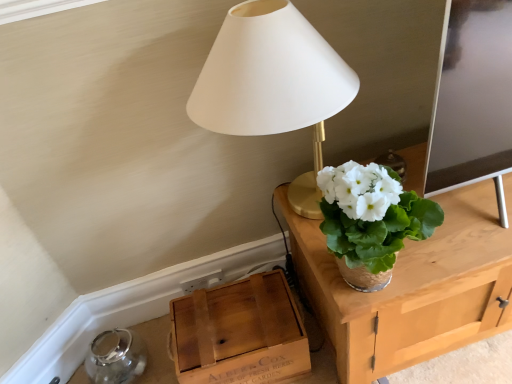
Question: Considering the relative sizes of wooden crate at lower left and white matte lampshade at upper center in the image provided, is wooden crate at lower left smaller than white matte lampshade at upper center?

Choices:
 (A) no
 (B) yes

Answer: (B)

Question: Does wooden crate at lower left have a greater height compared to white matte lampshade at upper center?

Choices:
 (A) no
 (B) yes

Answer: (A)

Question: Is wooden crate at lower left behind white matte lampshade at upper center?

Choices:
 (A) no
 (B) yes

Answer: (B)

Question: From a real-world perspective, does wooden crate at lower left sit lower than white matte lampshade at upper center?

Choices:
 (A) no
 (B) yes

Answer: (B)

Question: Is wooden crate at lower left to the right of white matte lampshade at upper center from the viewer's perspective?

Choices:
 (A) yes
 (B) no

Answer: (B)

Question: From their relative heights in the image, would you say wooden crate at lower left is taller or shorter than white matte lampshade at upper center?

Choices:
 (A) short
 (B) tall

Answer: (A)

Question: Considering the positions of point (189, 362) and point (344, 99), is point (189, 362) closer or farther from the camera than point (344, 99)?

Choices:
 (A) farther
 (B) closer

Answer: (A)

Question: In terms of size, does wooden crate at lower left appear bigger or smaller than white matte lampshade at upper center?

Choices:
 (A) small
 (B) big

Answer: (A)

Question: Which is correct: wooden crate at lower left is inside white matte lampshade at upper center, or outside of it?

Choices:
 (A) outside
 (B) inside

Answer: (A)

Question: Is point (478, 279) closer or farther from the camera than point (273, 112)?

Choices:
 (A) farther
 (B) closer

Answer: (A)

Question: From the image's perspective, is woven straw vase at upper right above or below white matte lampshade at upper center?

Choices:
 (A) below
 (B) above

Answer: (A)

Question: Is woven straw vase at upper right inside the boundaries of white matte lampshade at upper center, or outside?

Choices:
 (A) outside
 (B) inside

Answer: (A)

Question: Considering the positions of woven straw vase at upper right and white matte lampshade at upper center in the image, is woven straw vase at upper right taller or shorter than white matte lampshade at upper center?

Choices:
 (A) tall
 (B) short

Answer: (B)

Question: From the image's perspective, is woven straw vase at upper right located above or below wooden crate at lower left?

Choices:
 (A) above
 (B) below

Answer: (A)

Question: Visually, is woven straw vase at upper right positioned to the left or to the right of wooden crate at lower left?

Choices:
 (A) right
 (B) left

Answer: (A)